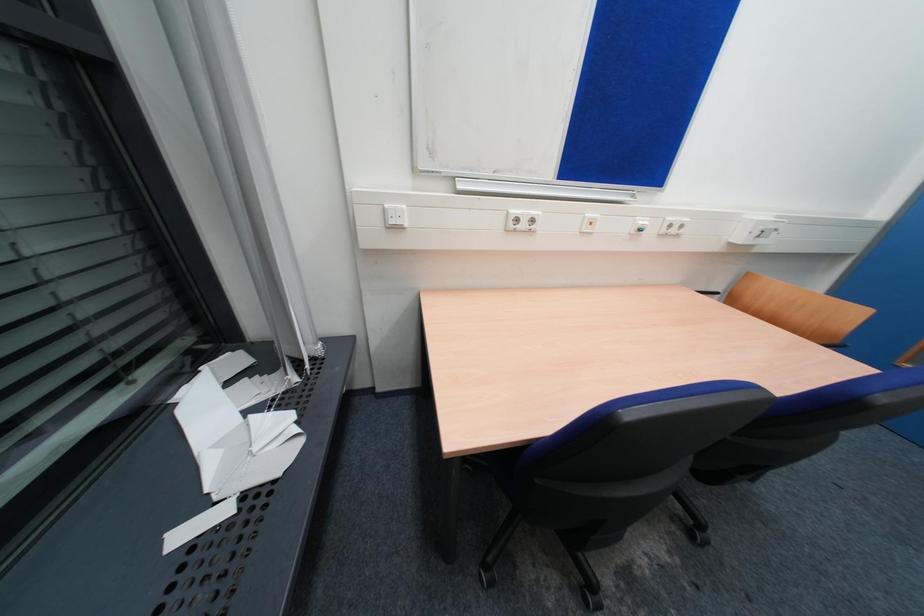
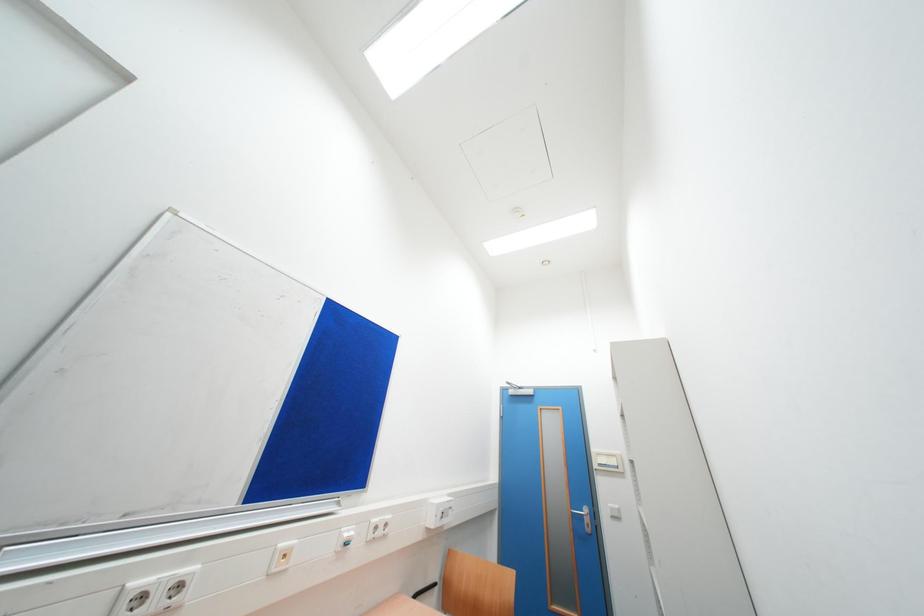
Based on the continuous images, in which direction is the camera rotating?

The camera's rotation is toward right-up.